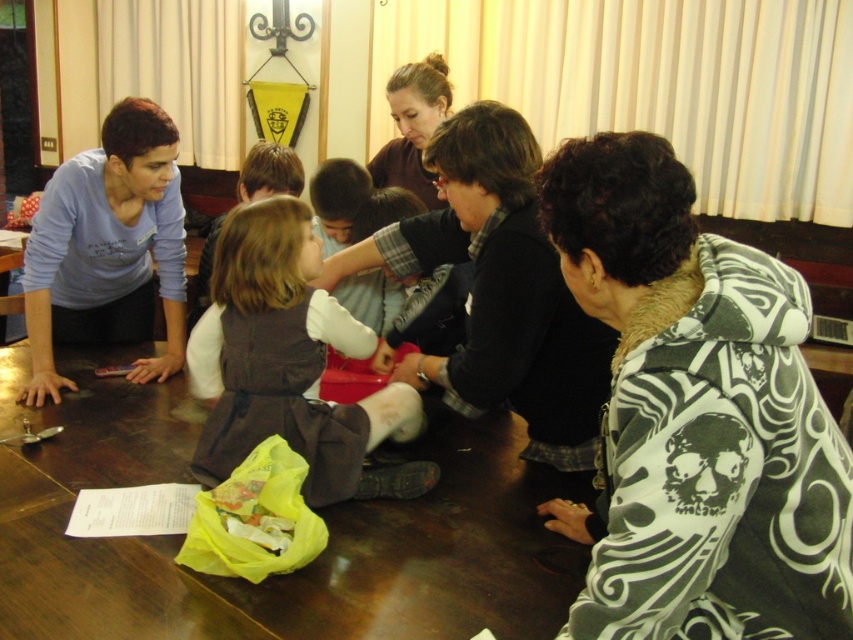
Between point (219, 346) and point (432, 113), which one is positioned behind?

Positioned behind is point (432, 113).

Who is more forward, (399, 413) or (422, 124)?

Positioned in front is point (399, 413).

You are a GUI agent. You are given a task and a screenshot of the screen. Output one action in this format:
    pyautogui.click(x=<x>, y=<y>)
    Task: Click on the dark gray fabric dress at center
    
    Given the screenshot: What is the action you would take?
    pyautogui.click(x=289, y=365)

Does brown polished wood table at center have a lesser width compared to black sweater at center?

In fact, brown polished wood table at center might be wider than black sweater at center.

Who is more distant from viewer, [323,572] or [486,262]?

Positioned behind is point [486,262].

I want to click on brown polished wood table at center, so click(x=281, y=576).

Measure the distance from dark green hoodie at lower right to matte blue shirt at left.

dark green hoodie at lower right and matte blue shirt at left are 1.56 meters apart.

Can you confirm if dark green hoodie at lower right is bigger than matte blue shirt at left?

Incorrect, dark green hoodie at lower right is not larger than matte blue shirt at left.

Does point (648, 195) lie in front of point (36, 330)?

Yes.

Image resolution: width=853 pixels, height=640 pixels. Find the location of `dark green hoodie at lower right`. dark green hoodie at lower right is located at coordinates (698, 416).